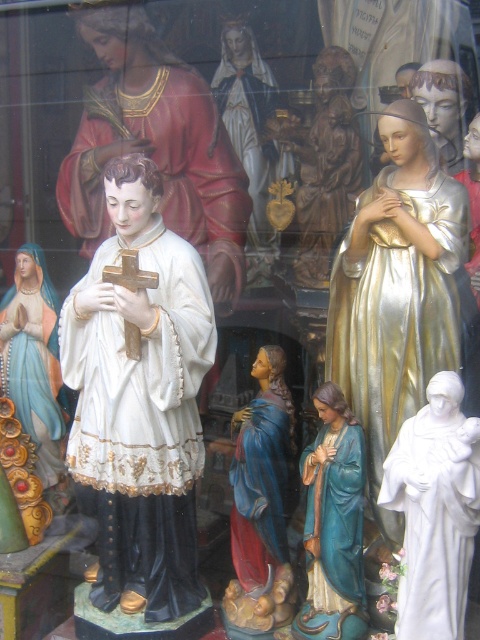
Question: Which of the following is the closest to the observer?

Choices:
 (A) (41, 332)
 (B) (104, 125)

Answer: (A)

Question: Is matte white statue at center behind wooden cross at center?

Choices:
 (A) no
 (B) yes

Answer: (B)

Question: Which point is farther from the camera taking this photo?

Choices:
 (A) [232, 144]
 (B) [127, 353]
 (C) [151, 96]
 (D) [384, 362]

Answer: (A)

Question: Is the position of blue glossy statue at lower center more distant than that of wooden cross at center?

Choices:
 (A) yes
 (B) no

Answer: (A)

Question: Which object is positioned farthest from the wooden cross at center?

Choices:
 (A) wooden statue at center
 (B) gold glossy statue at upper right
 (C) blue glossy statue at lower center
 (D) white glossy statue at center

Answer: (A)

Question: Does gold glossy statue at upper right appear on the right side of gold leaf statue at center?

Choices:
 (A) no
 (B) yes

Answer: (B)